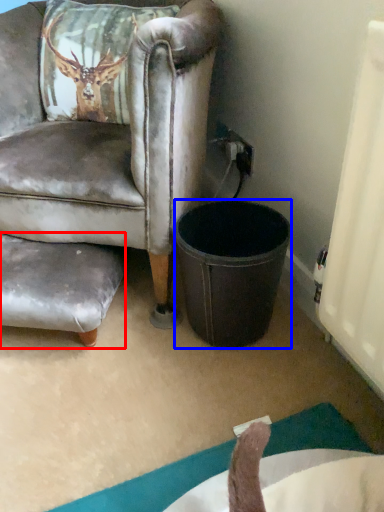
Question: Which object is further to the camera taking this photo, swivel chair (highlighted by a red box) or trash bin/can (highlighted by a blue box)?

Choices:
 (A) swivel chair
 (B) trash bin/can

Answer: (A)